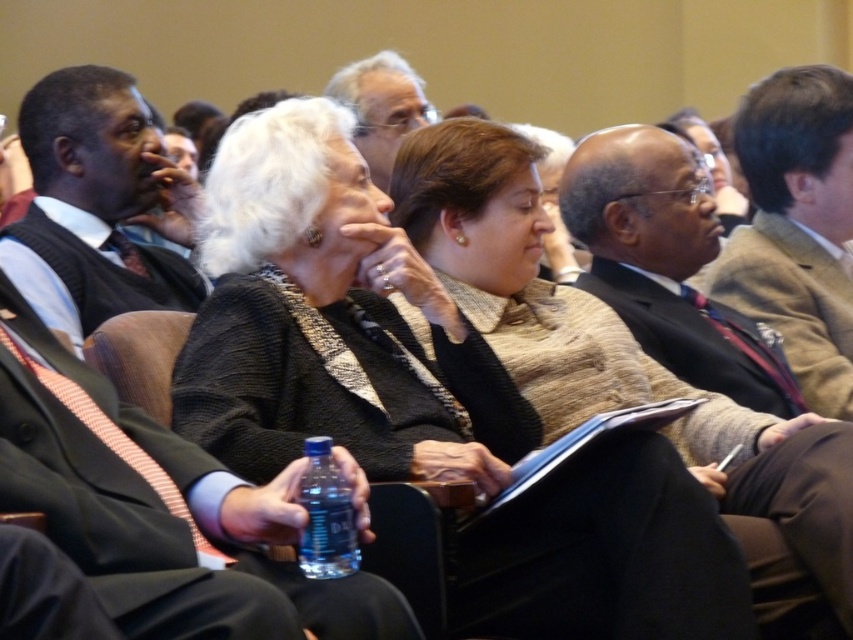
Question: Which point is farther to the camera?

Choices:
 (A) (363, 76)
 (B) (775, 83)
 (C) (321, 557)
 (D) (115, 280)

Answer: (A)

Question: Is the position of black wool sweater at center more distant than that of black wool vest at left?

Choices:
 (A) no
 (B) yes

Answer: (A)

Question: Which object is closer to the camera taking this photo?

Choices:
 (A) black wool vest at left
 (B) brown wool suit at upper right
 (C) blue plastic bottle at center

Answer: (C)

Question: Can you confirm if black wool sweater at center is positioned below brown wool suit at upper right?

Choices:
 (A) no
 (B) yes

Answer: (B)

Question: Observing the image, what is the correct spatial positioning of brown wool suit at upper right in reference to black suit at center?

Choices:
 (A) left
 (B) right

Answer: (B)

Question: Which of these objects is positioned farthest from the matte gray hair at upper center?

Choices:
 (A) black wool vest at left
 (B) blue plastic bottle at center

Answer: (B)